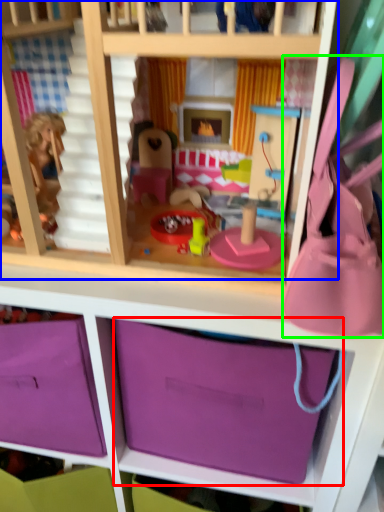
Question: Which object is the closest to the storage box (highlighted by a red box)? Choose among these: bunk bed (highlighted by a blue box) or accessory (highlighted by a green box).

Choices:
 (A) bunk bed
 (B) accessory

Answer: (B)